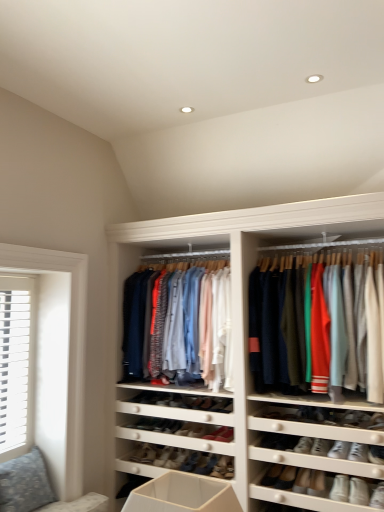
Question: Considering the relative sizes of leather sneaker at center, the 1th shoe when ordered from bottom to top, and matte cotton shirts at center, which ranks as the 1th clothing in left-to-right order, in the image provided, is leather sneaker at center, the 1th shoe when ordered from bottom to top, smaller than matte cotton shirts at center, which ranks as the 1th clothing in left-to-right order,?

Choices:
 (A) yes
 (B) no

Answer: (A)

Question: Does leather sneaker at center, the 1th shoe when ordered from bottom to top, appear on the left side of matte cotton shirts at center, marked as the 2th clothing in a right-to-left arrangement?

Choices:
 (A) yes
 (B) no

Answer: (A)

Question: Does leather sneaker at center, the 1th shoe when ordered from bottom to top, have a larger size compared to matte cotton shirts at center, marked as the 2th clothing in a right-to-left arrangement?

Choices:
 (A) no
 (B) yes

Answer: (A)

Question: Is leather sneaker at center, the 2th shoe when ordered from left to right, located outside matte cotton shirts at center, marked as the 2th clothing in a right-to-left arrangement?

Choices:
 (A) yes
 (B) no

Answer: (A)

Question: Is leather sneaker at center, the 1th shoe when ordered from bottom to top, beside matte cotton shirts at center, marked as the 2th clothing in a right-to-left arrangement?

Choices:
 (A) no
 (B) yes

Answer: (A)

Question: Is leather sneaker at center, the 2th shoe when ordered from left to right, closer to the viewer compared to matte cotton shirts at center, marked as the 2th clothing in a right-to-left arrangement?

Choices:
 (A) no
 (B) yes

Answer: (A)

Question: Does matte cotton shirts at center, arranged as the 2th clothing when viewed from the left, have a lesser width compared to matte cotton shirts at center, which ranks as the 1th clothing in left-to-right order?

Choices:
 (A) yes
 (B) no

Answer: (B)

Question: From a real-world perspective, is matte cotton shirts at center, acting as the 1th clothing starting from the right, beneath matte cotton shirts at center, which ranks as the 1th clothing in left-to-right order?

Choices:
 (A) yes
 (B) no

Answer: (A)

Question: Is matte cotton shirts at center, acting as the 1th clothing starting from the right, shorter than matte cotton shirts at center, marked as the 2th clothing in a right-to-left arrangement?

Choices:
 (A) no
 (B) yes

Answer: (A)

Question: Does matte cotton shirts at center, arranged as the 2th clothing when viewed from the left, have a greater width compared to matte cotton shirts at center, marked as the 2th clothing in a right-to-left arrangement?

Choices:
 (A) yes
 (B) no

Answer: (A)

Question: Is matte cotton shirts at center, acting as the 1th clothing starting from the right, aimed at matte cotton shirts at center, which ranks as the 1th clothing in left-to-right order?

Choices:
 (A) no
 (B) yes

Answer: (A)

Question: Does matte cotton shirts at center, acting as the 1th clothing starting from the right, have a greater height compared to matte cotton shirts at center, which ranks as the 1th clothing in left-to-right order?

Choices:
 (A) no
 (B) yes

Answer: (B)

Question: Does matte cotton shirts at center, which ranks as the 1th clothing in left-to-right order, have a larger size compared to matte cotton shirts at center, arranged as the 2th clothing when viewed from the left?

Choices:
 (A) yes
 (B) no

Answer: (B)